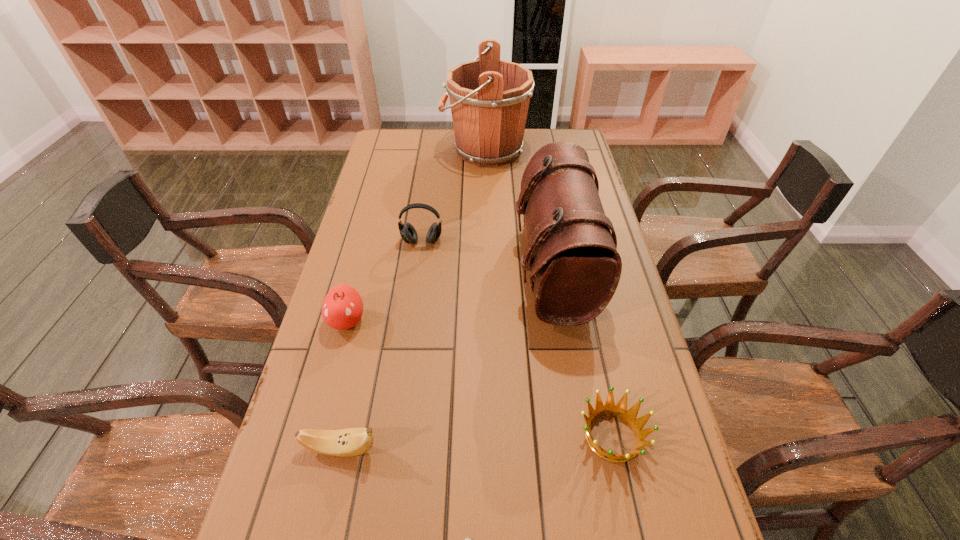
At what (x,y) coordinates should I click in order to perform the action: click on free space located on the front-facing side of the satchel. Please return your answer as a coordinate pair (x, y). The image size is (960, 540). Looking at the image, I should click on (438, 269).

Locate an element on the screen. The width and height of the screenshot is (960, 540). free space located on the front-facing side of the satchel is located at coordinates (463, 269).

Where is `vacant point located 0.090m on the front-facing side of the satchel`? The width and height of the screenshot is (960, 540). vacant point located 0.090m on the front-facing side of the satchel is located at coordinates (484, 269).

Image resolution: width=960 pixels, height=540 pixels. Identify the location of free location located on the ear cups of the fifth shortest object. (405, 363).

Identify the location of free region located 0.380m on the front of the apple. This screenshot has height=540, width=960. (298, 505).

Find the location of `free location located on the back of the banana`. free location located on the back of the banana is located at coordinates pyautogui.click(x=371, y=313).

At what (x,y) coordinates should I click in order to perform the action: click on free point located on the left of the second shortest object. Please return your answer as a coordinate pair (x, y). Looking at the image, I should click on (403, 436).

Identify the location of object located in the far edge section of the desktop. Image resolution: width=960 pixels, height=540 pixels. (489, 98).

Identify the location of headset positioned at the left edge. The image size is (960, 540). (408, 233).

This screenshot has width=960, height=540. Find the location of `apple that is at the left edge`. apple that is at the left edge is located at coordinates (342, 308).